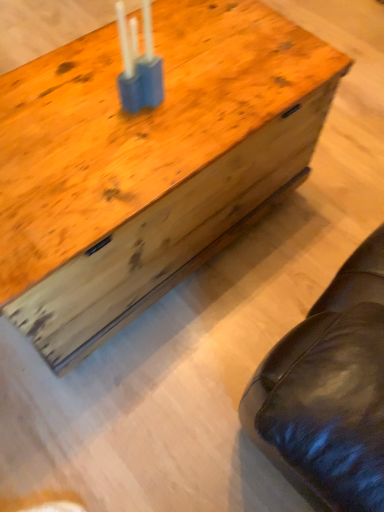
This screenshot has width=384, height=512. Identify the location of free space in front of blue plastic candle holder at center. (122, 154).